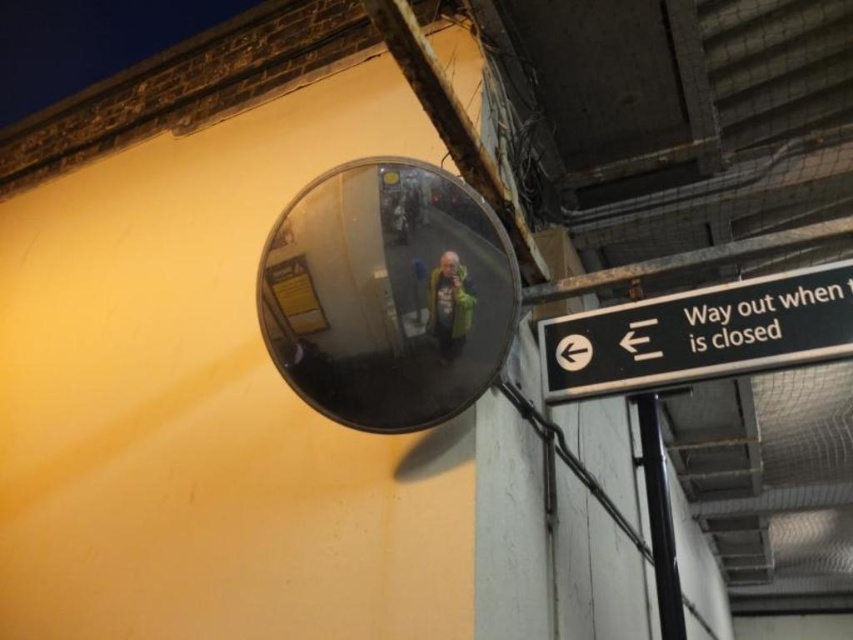
Question: Which object is positioned farthest from the black metal pole at lower right?

Choices:
 (A) transparent glass mirror at upper center
 (B) black plastic sign at upper right

Answer: (A)

Question: Can you confirm if transparent glass mirror at upper center is smaller than black metal pole at lower right?

Choices:
 (A) no
 (B) yes

Answer: (B)

Question: Estimate the real-world distances between objects in this image. Which object is closer to the black metal pole at lower right?

Choices:
 (A) transparent glass mirror at upper center
 (B) black plastic sign at upper right

Answer: (B)

Question: From the image, what is the correct spatial relationship of transparent glass mirror at upper center in relation to black metal pole at lower right?

Choices:
 (A) right
 (B) left

Answer: (B)

Question: Which point is closer to the camera?

Choices:
 (A) black plastic sign at upper right
 (B) transparent glass mirror at upper center
 (C) black metal pole at lower right

Answer: (B)

Question: Is black plastic sign at upper right positioned in front of black metal pole at lower right?

Choices:
 (A) no
 (B) yes

Answer: (B)